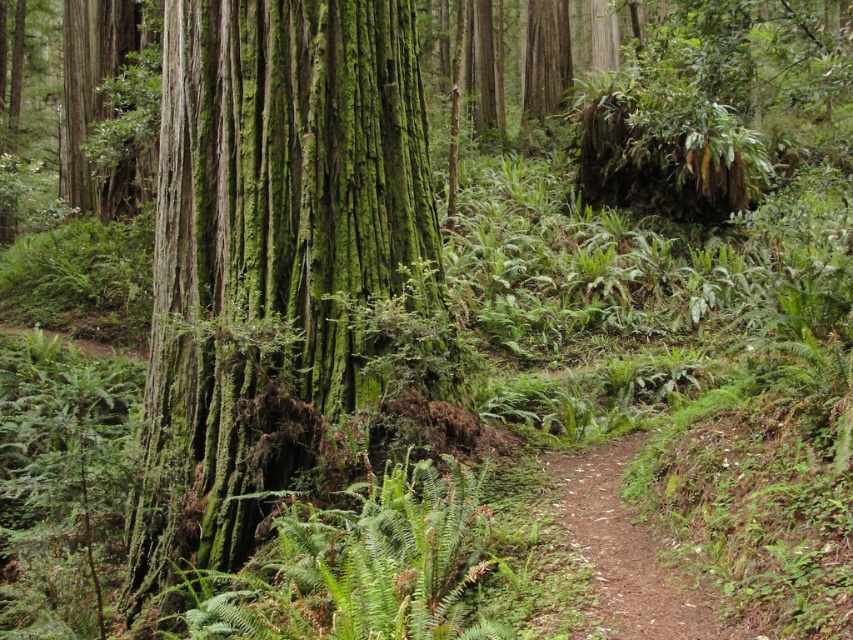
Between point (282, 108) and point (711, 609), which one is positioned in front?

Positioned in front is point (711, 609).

Between green mossy bark tree at center and brown dirt path at center, which one appears on the left side from the viewer's perspective?

Positioned to the left is green mossy bark tree at center.

The height and width of the screenshot is (640, 853). I want to click on green mossy bark tree at center, so click(x=280, y=262).